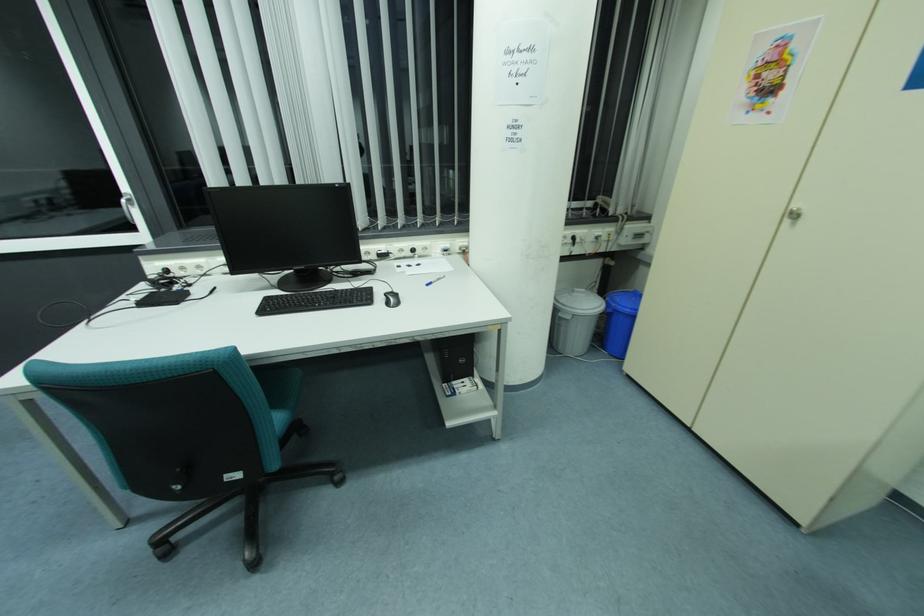
Image resolution: width=924 pixels, height=616 pixels. In order to click on silver cabinet knob in this screenshot , I will do `click(794, 214)`.